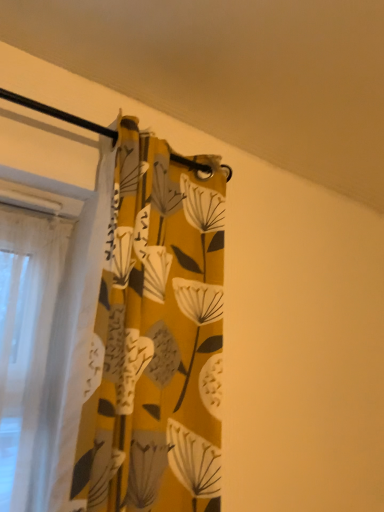
Question: Is yellow fabric curtain at left facing away from yellow fabric at upper left?

Choices:
 (A) no
 (B) yes

Answer: (A)

Question: Is yellow fabric curtain at left taller than yellow fabric at upper left?

Choices:
 (A) yes
 (B) no

Answer: (A)

Question: Can you confirm if yellow fabric curtain at left is positioned to the right of yellow fabric at upper left?

Choices:
 (A) no
 (B) yes

Answer: (A)

Question: Does yellow fabric curtain at left lie in front of yellow fabric at upper left?

Choices:
 (A) yes
 (B) no

Answer: (B)

Question: From the image's perspective, is yellow fabric curtain at left above yellow fabric at upper left?

Choices:
 (A) yes
 (B) no

Answer: (B)

Question: Is yellow fabric curtain at left facing towards yellow fabric at upper left?

Choices:
 (A) yes
 (B) no

Answer: (B)

Question: Is yellow fabric curtain at left inside yellow fabric at upper left?

Choices:
 (A) no
 (B) yes

Answer: (A)

Question: Is the depth of yellow fabric at upper left greater than that of yellow fabric curtain at left?

Choices:
 (A) yes
 (B) no

Answer: (B)

Question: Is yellow fabric at upper left shorter than yellow fabric curtain at left?

Choices:
 (A) yes
 (B) no

Answer: (A)

Question: From a real-world perspective, is yellow fabric at upper left located higher than yellow fabric curtain at left?

Choices:
 (A) yes
 (B) no

Answer: (A)

Question: Is yellow fabric at upper left beside yellow fabric curtain at left?

Choices:
 (A) yes
 (B) no

Answer: (B)

Question: Is yellow fabric at upper left smaller than yellow fabric curtain at left?

Choices:
 (A) no
 (B) yes

Answer: (A)

Question: Looking at the image, does yellow fabric at upper left seem bigger or smaller compared to yellow fabric curtain at left?

Choices:
 (A) big
 (B) small

Answer: (A)